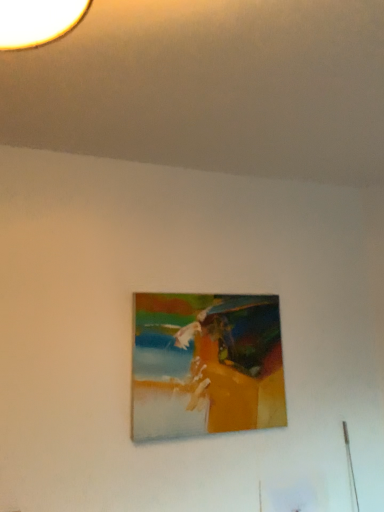
Describe the element at coordinates (206, 365) in the screenshot. The height and width of the screenshot is (512, 384). I see `matte acrylic painting at center` at that location.

Where is `matte acrylic painting at center`? Image resolution: width=384 pixels, height=512 pixels. matte acrylic painting at center is located at coordinates (206, 365).

Identify the location of matte acrylic painting at center. This screenshot has height=512, width=384. (206, 365).